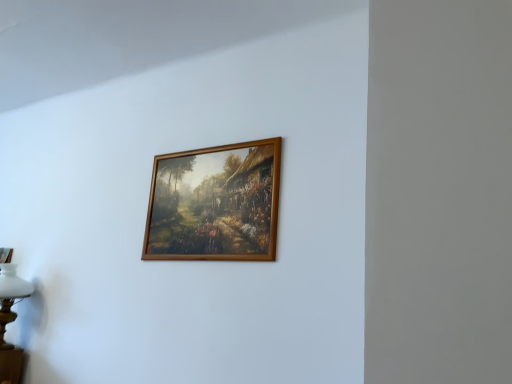
This screenshot has height=384, width=512. I want to click on wooden frame at center, so click(x=215, y=203).

What do you see at coordinates (215, 203) in the screenshot? This screenshot has width=512, height=384. I see `wooden frame at center` at bounding box center [215, 203].

This screenshot has width=512, height=384. What do you see at coordinates (10, 297) in the screenshot?
I see `white glass table lamp at lower left` at bounding box center [10, 297].

Measure the distance between point [24,286] and camera.

Point [24,286] and camera are 2.42 meters apart from each other.

Locate an element on the screen. This screenshot has height=384, width=512. white glass table lamp at lower left is located at coordinates (10, 297).

Locate an element on the screen. The width and height of the screenshot is (512, 384). wooden frame at center is located at coordinates (215, 203).

In the image, is wooden frame at center on the left side or the right side of white glass table lamp at lower left?

wooden frame at center is positioned on white glass table lamp at lower left's right side.

Is the position of wooden frame at center more distant than that of white glass table lamp at lower left?

No, wooden frame at center is closer to the viewer.

Is point (184, 177) closer or farther from the camera than point (20, 296)?

Point (184, 177) appears to be closer to the viewer than point (20, 296).

From the image's perspective, which one is positioned lower, wooden frame at center or white glass table lamp at lower left?

white glass table lamp at lower left, from the image's perspective.

From a real-world perspective, is wooden frame at center located higher than white glass table lamp at lower left?

Yes, from a real-world perspective, wooden frame at center is above white glass table lamp at lower left.

Consider the image. Can you confirm if wooden frame at center is wider than white glass table lamp at lower left?

No, wooden frame at center is not wider than white glass table lamp at lower left.

Who is shorter, wooden frame at center or white glass table lamp at lower left?

white glass table lamp at lower left is shorter.

Between wooden frame at center and white glass table lamp at lower left, which one has larger size?

white glass table lamp at lower left.

Can white glass table lamp at lower left be found inside wooden frame at center?

No, white glass table lamp at lower left is not inside wooden frame at center.

Is the surface of wooden frame at center in direct contact with white glass table lamp at lower left?

They are not placed beside each other.

Could you tell me if wooden frame at center is turned towards white glass table lamp at lower left?

No, wooden frame at center is not aimed at white glass table lamp at lower left.

Consider the image. What's the angular difference between wooden frame at center and white glass table lamp at lower left's facing directions?

There is a 0.662-degree angle between the facing directions of wooden frame at center and white glass table lamp at lower left.

In the scene shown: How much distance is there between wooden frame at center and white glass table lamp at lower left?

The distance of wooden frame at center from white glass table lamp at lower left is 1.23 meters.

At what (x,y) coordinates should I click in order to perform the action: click on table lamp on the left of the wooden frame at center. Please return your answer as a coordinate pair (x, y). The height and width of the screenshot is (384, 512). Looking at the image, I should click on (10, 297).

Which object is positioned more to the left, white glass table lamp at lower left or wooden frame at center?

Positioned to the left is white glass table lamp at lower left.

Is white glass table lamp at lower left closer to the viewer compared to wooden frame at center?

No, it is not.

Which point is more distant from viewer, [1,329] or [275,138]?

Point [1,329]

From the image's perspective, which one is positioned lower, white glass table lamp at lower left or wooden frame at center?

From the image's view, white glass table lamp at lower left is below.

From a real-world perspective, is white glass table lamp at lower left positioned above or below wooden frame at center?

From a real-world perspective, white glass table lamp at lower left is physically below wooden frame at center.

Which object is thinner, white glass table lamp at lower left or wooden frame at center?

wooden frame at center.

Is white glass table lamp at lower left taller or shorter than wooden frame at center?

Considering their sizes, white glass table lamp at lower left has less height than wooden frame at center.

Looking at the image, does white glass table lamp at lower left seem bigger or smaller compared to wooden frame at center?

Considering their sizes, white glass table lamp at lower left takes up more space than wooden frame at center.

Choose the correct answer: Is white glass table lamp at lower left inside wooden frame at center or outside it?

white glass table lamp at lower left is located beyond the bounds of wooden frame at center.

Is white glass table lamp at lower left far from wooden frame at center?

Yes, white glass table lamp at lower left and wooden frame at center are quite far apart.

Is wooden frame at center at the back of white glass table lamp at lower left?

That's not correct — white glass table lamp at lower left is not looking away from wooden frame at center.

Identify the location of picture frame located on the right of white glass table lamp at lower left. The height and width of the screenshot is (384, 512). (215, 203).

Identify the location of picture frame located above the white glass table lamp at lower left (from the image's perspective). tap(215, 203).

I want to click on picture frame that is on the right side of white glass table lamp at lower left, so click(215, 203).